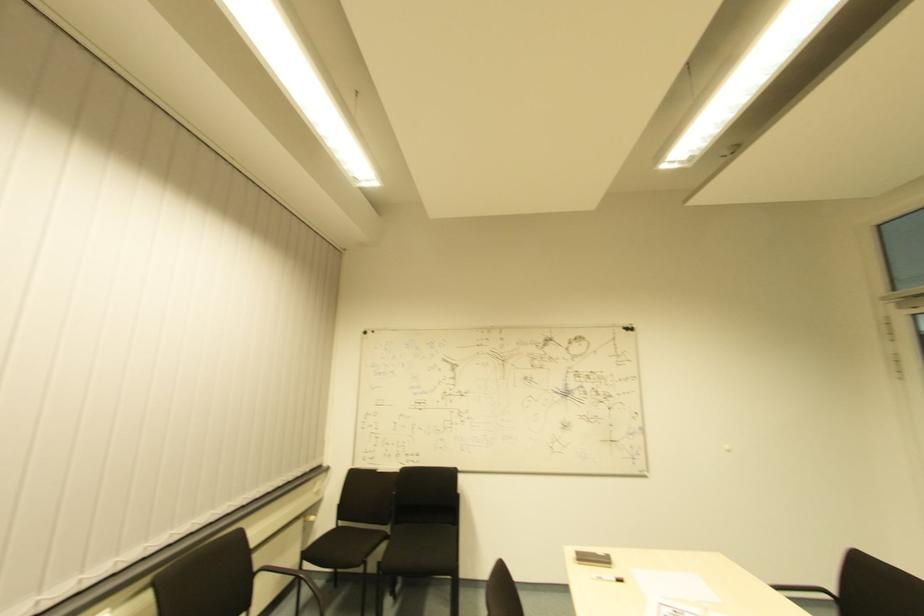
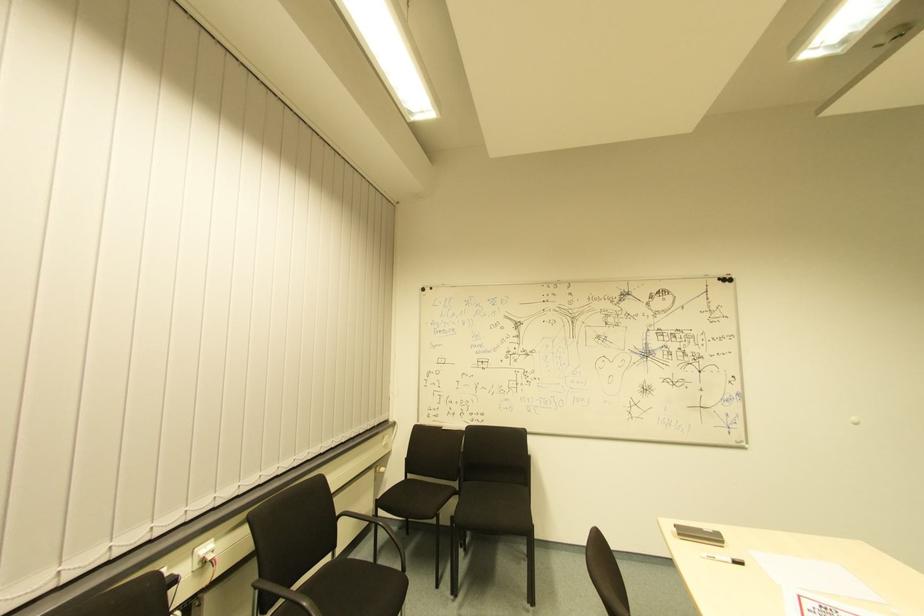
Which direction would the cameraman need to move to produce the second image?

The cameraman walked toward left, forward.